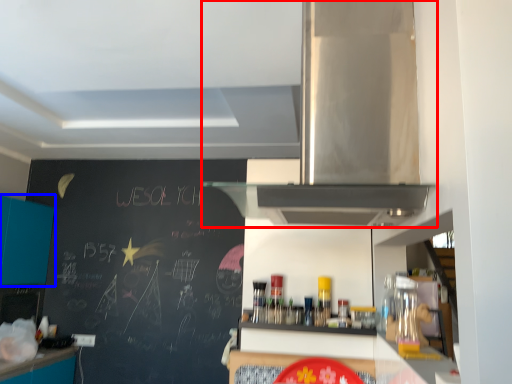
Question: Among these objects, which one is nearest to the camera, home appliance (highlighted by a red box) or cabinetry (highlighted by a blue box)?

Choices:
 (A) home appliance
 (B) cabinetry

Answer: (A)